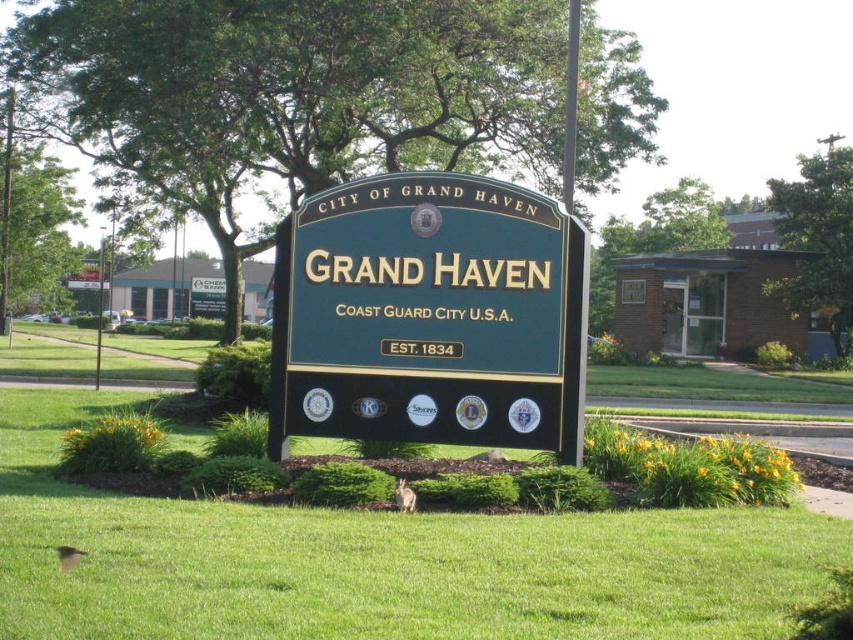
Does green grass at center appear over green polished wood sign at center?

No.

Does point (90, 529) come in front of point (380, 324)?

That is True.

Find the location of a particular element. This screenshot has width=853, height=640. green grass at center is located at coordinates (379, 561).